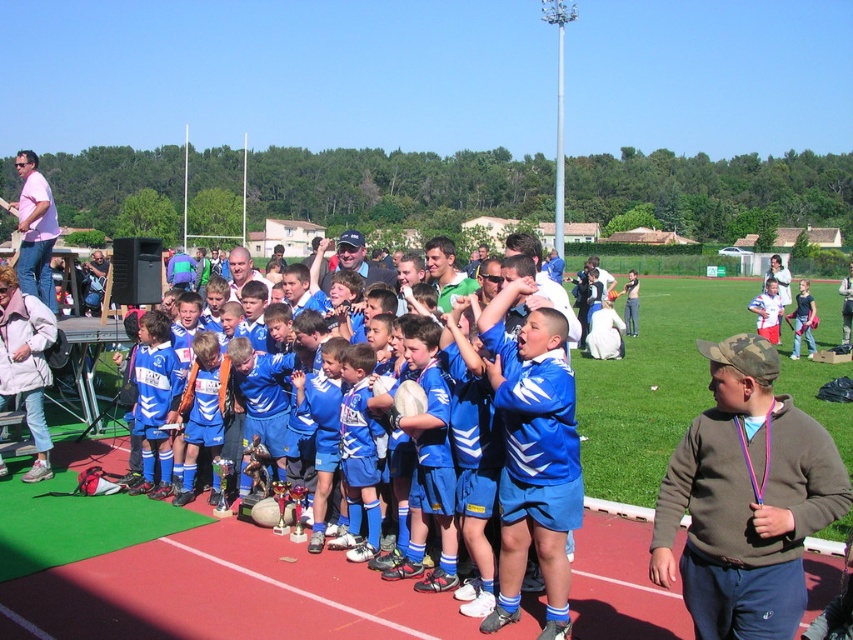
You are a photographer at the event and want to capture a photo of the blue jersey at center without the brown fleece sweatshirt at lower right blocking it. How should you adjust your position?

The brown fleece sweatshirt at lower right is in front of the blue jersey at center, so to avoid blocking, move your camera position to the side or angle it so that the blue jersey at center is no longer obscured by the brown fleece sweatshirt at lower right.

Based on the photo, you are a photographer trying to capture a group photo of the athletes. You notice the brown fleece sweatshirt at lower right and the blue jersey at center. Which item is narrower in width?

The brown fleece sweatshirt at lower right is narrower in width than the blue jersey at center.